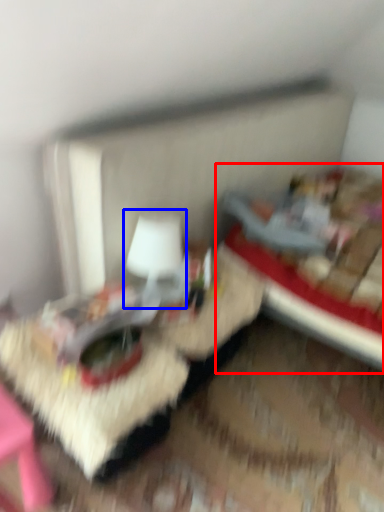
Question: Which point is further to the camera, bed (highlighted by a red box) or table lamp (highlighted by a blue box)?

Choices:
 (A) bed
 (B) table lamp

Answer: (B)